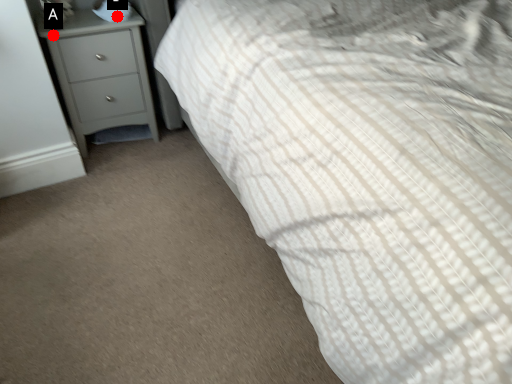
Question: Two points are circled on the image, labeled by A and B beside each circle. Among these points, which one is nearest to the camera?

Choices:
 (A) A is closer
 (B) B is closer

Answer: (A)